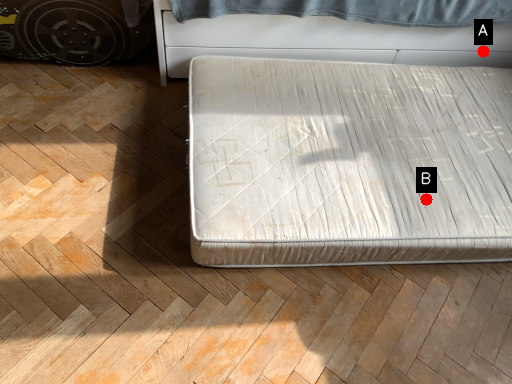
Question: Two points are circled on the image, labeled by A and B beside each circle. Which point appears closest to the camera in this image?

Choices:
 (A) A is closer
 (B) B is closer

Answer: (B)